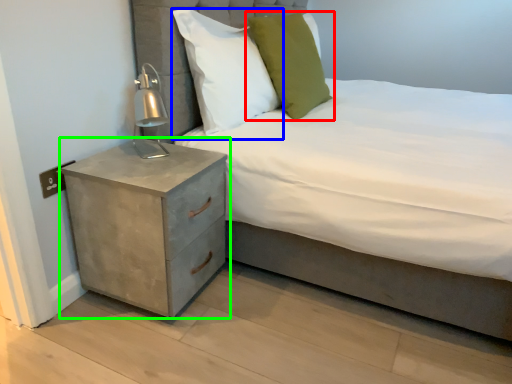
Question: Considering the real-world distances, which object is farthest from pillow (highlighted by a red box)? pillow (highlighted by a blue box) or nightstand (highlighted by a green box)?

Choices:
 (A) pillow
 (B) nightstand

Answer: (B)